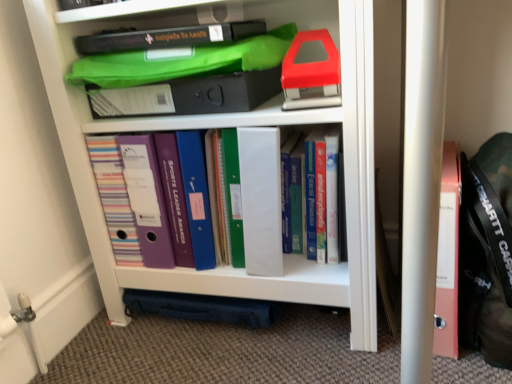
Measure the distance between point (370, 150) and camera.

The depth of point (370, 150) is 28.86 inches.

Describe the element at coordinates (233, 125) in the screenshot. Image resolution: width=512 pixels, height=384 pixels. I see `white plastic shelf at center` at that location.

What do you see at coordinates (487, 252) in the screenshot?
I see `black fabric messenger bag at right` at bounding box center [487, 252].

Where is `white plastic shelf at center`? white plastic shelf at center is located at coordinates (233, 125).

You are a GUI agent. You are given a task and a screenshot of the screen. Output one action in this format:
    pyautogui.click(x=<x>, y=<y>)
    Task: Click on the book that is the 2nd one above the black fabric messenger bag at right (from a real-world perspective)
    
    Given the screenshot: What is the action you would take?
    pyautogui.click(x=323, y=193)

Considering the relative positions of black fabric messenger bag at right and hardcover books at center, which is the 3th book from left to right, in the image provided, is black fabric messenger bag at right behind hardcover books at center, which is the 3th book from left to right,?

No, the depth of black fabric messenger bag at right is less than that of hardcover books at center, which is the 3th book from left to right.

Is black fabric messenger bag at right situated inside hardcover books at center, which is the 1th book in right-to-left order, or outside?

black fabric messenger bag at right is outside hardcover books at center, which is the 1th book in right-to-left order.

Is black fabric messenger bag at right turned away from hardcover books at center, which is the 3th book from left to right?

No, hardcover books at center, which is the 3th book from left to right, is not at the back of black fabric messenger bag at right.

Which of these two, white plastic shelf at center or hardcover books at center, which is the 1th book in right-to-left order, is thinner?

hardcover books at center, which is the 1th book in right-to-left order.

Considering the sizes of white plastic shelf at center and hardcover books at center, which is the 1th book in right-to-left order, in the image, is white plastic shelf at center taller or shorter than hardcover books at center, which is the 1th book in right-to-left order,?

white plastic shelf at center is taller than hardcover books at center, which is the 1th book in right-to-left order.

Locate an element on the screen. The image size is (512, 384). book that is the 2nd one when counting rightward from the white plastic shelf at center is located at coordinates (323, 193).

Is there a large distance between white plastic shelf at center and hardcover books at center, which is the 3th book from left to right?

No.

Is black fabric messenger bag at right smaller than white plastic shelf at center?

Indeed, black fabric messenger bag at right has a smaller size compared to white plastic shelf at center.

At what (x,y) coordinates should I click in order to perform the action: click on shelf above the black fabric messenger bag at right (from a real-world perspective). Please return your answer as a coordinate pair (x, y). This screenshot has width=512, height=384. Looking at the image, I should click on (233, 125).

Is black fabric messenger bag at right facing towards white plastic shelf at center?

No, black fabric messenger bag at right is not oriented towards white plastic shelf at center.

Can you confirm if black fabric messenger bag at right is shorter than white plastic shelf at center?

Yes.

Is hardcover books at center, which is the 3th book from left to right, not near white plastic shelf at center?

No, hardcover books at center, which is the 3th book from left to right, is not far away from white plastic shelf at center.

Considering the sizes of objects hardcover books at center, which is the 3th book from left to right, and white plastic shelf at center in the image provided, who is taller, hardcover books at center, which is the 3th book from left to right, or white plastic shelf at center?

white plastic shelf at center is taller.

Based on the photo, who is bigger, hardcover books at center, which is the 1th book in right-to-left order, or white plastic shelf at center?

Bigger between the two is white plastic shelf at center.

In the scene shown: From a real-world perspective, who is located higher, black fabric messenger bag at right or red plastic stapler at upper right, which appears as the 2th book when viewed from the left?

red plastic stapler at upper right, which appears as the 2th book when viewed from the left.

In terms of width, does black fabric messenger bag at right look wider or thinner when compared to red plastic stapler at upper right, which appears as the 2th book when viewed from the left?

Clearly, black fabric messenger bag at right has more width compared to red plastic stapler at upper right, which appears as the 2th book when viewed from the left.

In the image, there is a red plastic stapler at upper right, the 2th book viewed from the right. Find the location of `messenger bag below it (from a real-world perspective)`. messenger bag below it (from a real-world perspective) is located at coordinates (487, 252).

Can you confirm if black fabric messenger bag at right is smaller than red plastic stapler at upper right, the 2th book viewed from the right?

No, black fabric messenger bag at right is not smaller than red plastic stapler at upper right, the 2th book viewed from the right.

At what (x,y) coordinates should I click in order to perform the action: click on the 1st book counting from the right side of the white plastic shelf at center. Please return your answer as a coordinate pair (x, y). This screenshot has width=512, height=384. Looking at the image, I should click on (311, 74).

Does white plastic shelf at center have a larger size compared to red plastic stapler at upper right, the 2th book viewed from the right?

Indeed, white plastic shelf at center has a larger size compared to red plastic stapler at upper right, the 2th book viewed from the right.

How different are the orientations of white plastic shelf at center and red plastic stapler at upper right, the 2th book viewed from the right, in degrees?

The angle between the facing direction of white plastic shelf at center and the facing direction of red plastic stapler at upper right, the 2th book viewed from the right, is 2.84 degrees.

Who is taller, white plastic shelf at center or red plastic stapler at upper right, which appears as the 2th book when viewed from the left?

white plastic shelf at center.

Where is `shelf that appears in front of the black fabric messenger bag at right`? Image resolution: width=512 pixels, height=384 pixels. shelf that appears in front of the black fabric messenger bag at right is located at coordinates (233, 125).

Between white plastic shelf at center and black fabric messenger bag at right, which one has smaller size?

black fabric messenger bag at right.

Are white plastic shelf at center and black fabric messenger bag at right beside each other?

white plastic shelf at center is not next to black fabric messenger bag at right, and they're not touching.

Is white plastic shelf at center inside or outside of black fabric messenger bag at right?

white plastic shelf at center cannot be found inside black fabric messenger bag at right.

The width and height of the screenshot is (512, 384). I want to click on messenger bag below the hardcover books at center, which is the 3th book from left to right (from the image's perspective), so pos(487,252).

Find the location of a particular element. This screenshot has height=384, width=512. shelf that is on the left side of hardcover books at center, which is the 3th book from left to right is located at coordinates (233, 125).

Considering their positions, is black fabric messenger bag at right positioned further to matte plastic folders at center, the 1th book from the left, than hardcover books at center, which is the 3th book from left to right?

The object further to matte plastic folders at center, the 1th book from the left, is black fabric messenger bag at right.

When comparing their distances from black fabric messenger bag at right, does white plastic shelf at center or hardcover books at center, which is the 1th book in right-to-left order, seem closer?

hardcover books at center, which is the 1th book in right-to-left order.

When comparing their distances from matte plastic folders at center, the 3th book viewed from the right, does black fabric messenger bag at right or white plastic shelf at center seem closer?

white plastic shelf at center is closer to matte plastic folders at center, the 3th book viewed from the right.

Looking at the image, which one is located further to red plastic stapler at upper right, the 2th book viewed from the right, black fabric messenger bag at right or matte plastic folders at center, the 1th book from the left?

black fabric messenger bag at right is further to red plastic stapler at upper right, the 2th book viewed from the right.

Looking at the image, which one is located closer to hardcover books at center, which is the 3th book from left to right, matte plastic folders at center, the 1th book from the left, or white plastic shelf at center?

The object closer to hardcover books at center, which is the 3th book from left to right, is white plastic shelf at center.

Considering their positions, is black fabric messenger bag at right positioned further to white plastic shelf at center than matte plastic folders at center, the 3th book viewed from the right?

The object further to white plastic shelf at center is black fabric messenger bag at right.

From the picture: Based on their spatial positions, is matte plastic folders at center, the 1th book from the left, or hardcover books at center, which is the 1th book in right-to-left order, further from red plastic stapler at upper right, which appears as the 2th book when viewed from the left?

matte plastic folders at center, the 1th book from the left, is positioned further to the anchor red plastic stapler at upper right, which appears as the 2th book when viewed from the left.

Considering their positions, is hardcover books at center, which is the 1th book in right-to-left order, positioned further to black fabric messenger bag at right than red plastic stapler at upper right, which appears as the 2th book when viewed from the left?

red plastic stapler at upper right, which appears as the 2th book when viewed from the left, is further to black fabric messenger bag at right.

Image resolution: width=512 pixels, height=384 pixels. Find the location of `shelf between red plastic stapler at upper right, the 2th book viewed from the right, and matte plastic folders at center, the 1th book from the left, in the vertical direction`. shelf between red plastic stapler at upper right, the 2th book viewed from the right, and matte plastic folders at center, the 1th book from the left, in the vertical direction is located at coordinates (233, 125).

This screenshot has width=512, height=384. Identify the location of shelf located between matte plastic folders at center, the 3th book viewed from the right, and black fabric messenger bag at right in the left-right direction. (233, 125).

Locate an element on the screen. This screenshot has height=384, width=512. book located between matte plastic folders at center, the 1th book from the left, and hardcover books at center, which is the 3th book from left to right, in the left-right direction is located at coordinates point(311,74).

Image resolution: width=512 pixels, height=384 pixels. Identify the location of shelf located between matte plastic folders at center, the 3th book viewed from the right, and hardcover books at center, which is the 1th book in right-to-left order, in the left-right direction. (233, 125).